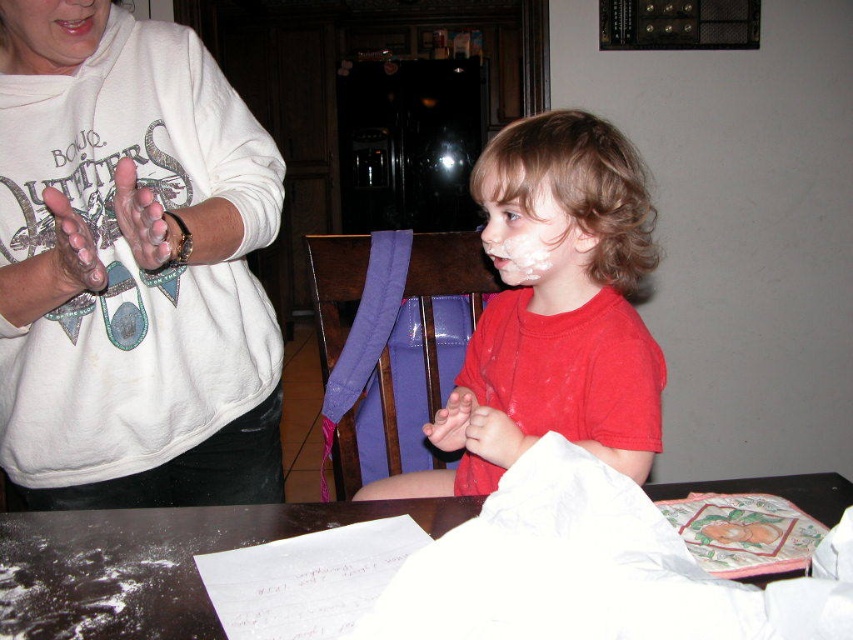
Question: Based on their relative distances, which object is nearer to the matte red shirt at center?

Choices:
 (A) white matte sweatshirt at upper left
 (B) smooth skin at upper left
 (C) white matte table at lower center

Answer: (A)

Question: Among these objects, which one is farthest from the camera?

Choices:
 (A) smooth skin at upper left
 (B) white matte face at center

Answer: (B)

Question: Among these objects, which one is farthest from the camera?

Choices:
 (A) white matte face at center
 (B) white matte sweatshirt at upper left

Answer: (A)

Question: Can you confirm if white matte face at center is wider than smooth skin at upper left?

Choices:
 (A) yes
 (B) no

Answer: (A)

Question: Can you confirm if white matte sweatshirt at upper left is positioned to the left of white matte table at lower center?

Choices:
 (A) yes
 (B) no

Answer: (A)

Question: Where is white matte sweatshirt at upper left located in relation to smooth skin at upper left in the image?

Choices:
 (A) above
 (B) below

Answer: (B)